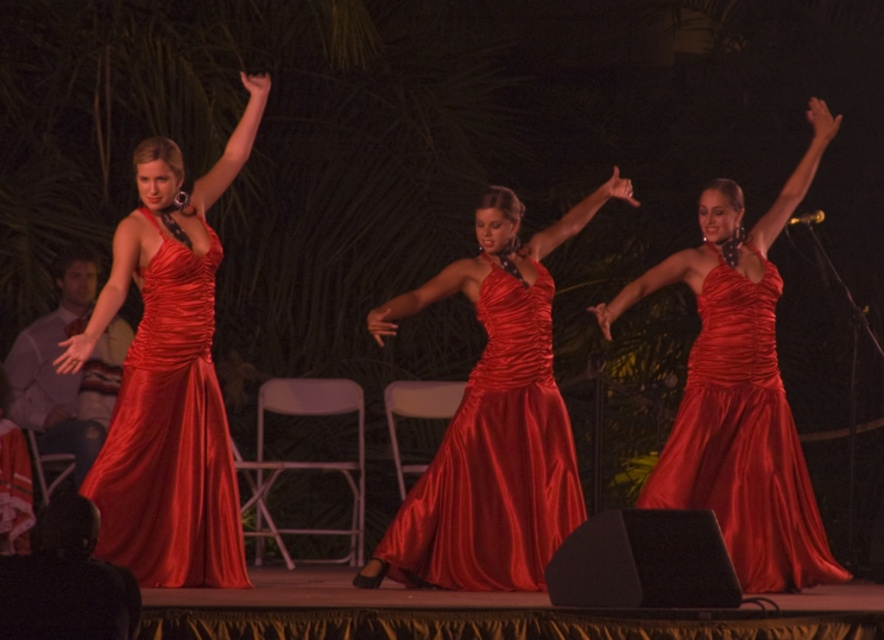
Question: Does satin dress at center appear under satin dress at left?

Choices:
 (A) yes
 (B) no

Answer: (A)

Question: Which point appears closest to the camera in this image?

Choices:
 (A) (479, 464)
 (B) (778, 392)
 (C) (166, 522)

Answer: (C)

Question: Which object is closer to the camera taking this photo?

Choices:
 (A) satin dress at left
 (B) satin dress at center

Answer: (A)

Question: Where is satin dress at left located in relation to shiny satin dress at center in the image?

Choices:
 (A) above
 (B) below

Answer: (A)

Question: Can you confirm if satin dress at left is smaller than shiny satin dress at center?

Choices:
 (A) yes
 (B) no

Answer: (A)

Question: Which of the following is the farthest from the observer?

Choices:
 (A) shiny satin dress at center
 (B) satin dress at left
 (C) satin dress at center

Answer: (A)